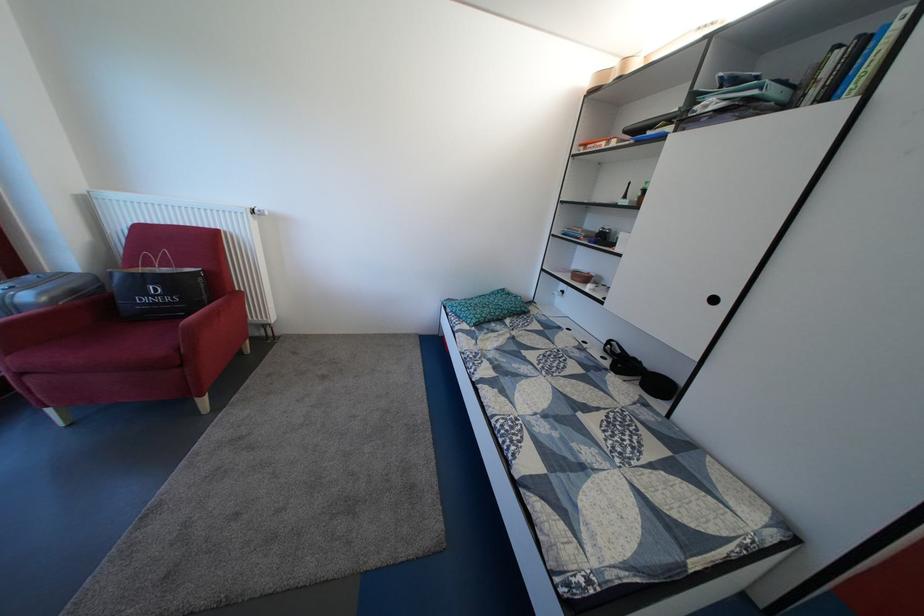
The width and height of the screenshot is (924, 616). I want to click on white radiator knob, so click(257, 211).